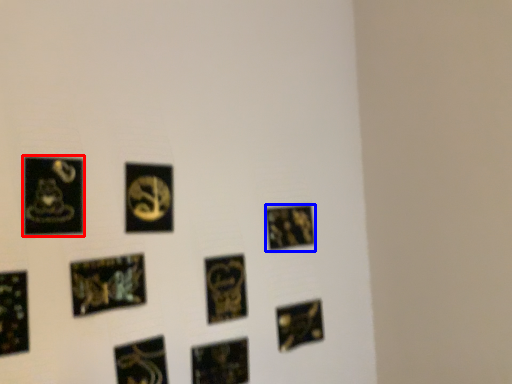
Question: Which object is further to the camera taking this photo, picture frame (highlighted by a red box) or picture frame (highlighted by a blue box)?

Choices:
 (A) picture frame
 (B) picture frame

Answer: (B)